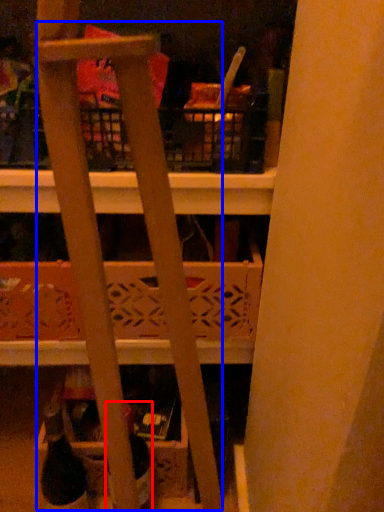
Question: Which of the following is the closest to the observer, bottle (highlighted by a red box) or ladder (highlighted by a blue box)?

Choices:
 (A) bottle
 (B) ladder

Answer: (B)